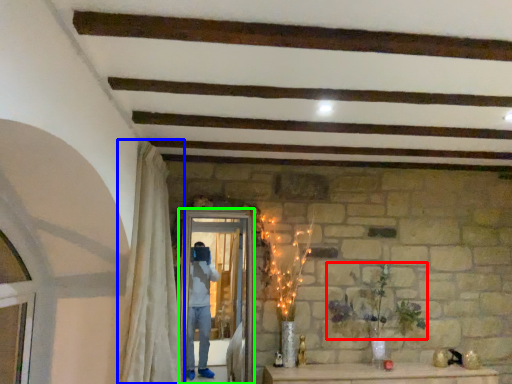
Question: Which is farther away from plant (highlighted by a red box)? curtain (highlighted by a blue box) or screen door (highlighted by a green box)?

Choices:
 (A) curtain
 (B) screen door

Answer: (A)